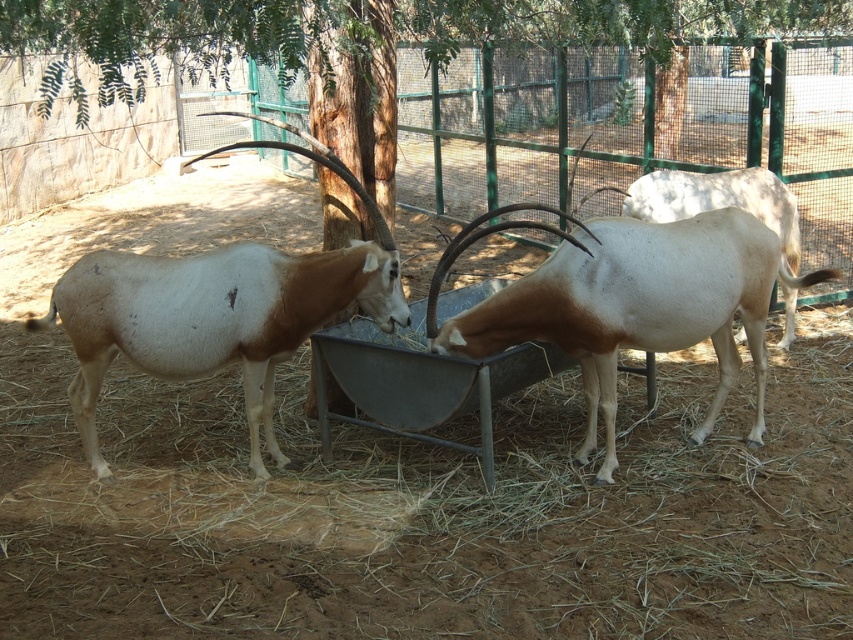
You are a zookeeper observing the two antelopes in the enclosure. You notice that the brown and white antelope at left and the white glossy antelope at center are facing different directions. Which antelope is facing away from the entrance located to the right of the trough?

The brown and white antelope at left is facing towards the right side of the image, which would be away from the entrance located to the right of the trough, so it is facing away from the entrance.

You are a zookeeper who needs to determine the feeding order based on size. Which antelope should be fed first, the brown and white antelope at left or the white glossy antelope at center?

The brown and white antelope at left should be fed first because it is taller than the white glossy antelope at center.

Looking at this image, you are a zookeeper standing at the center of the enclosure. You need to place a new feeding trough exactly where the brown and white antelope at left is currently located. What are the coordinates where you should place the new trough?

The coordinates for placing the new feeding trough should be at point (218, 308), which is where the brown and white antelope at left is located.